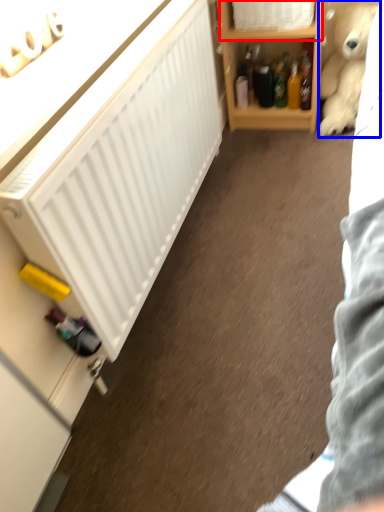
Question: Which point is further to the camera, cabinet (highlighted by a red box) or teddy bear (highlighted by a blue box)?

Choices:
 (A) cabinet
 (B) teddy bear

Answer: (A)